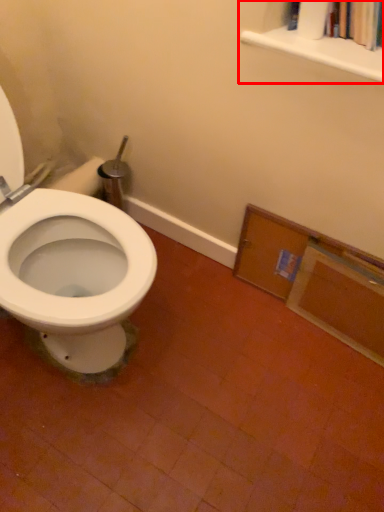
Question: From the image's perspective, considering the relative positions of bookcase (annotated by the red box) and medicine cabinet in the image provided, where is bookcase (annotated by the red box) located with respect to the staircase?

Choices:
 (A) below
 (B) above

Answer: (B)